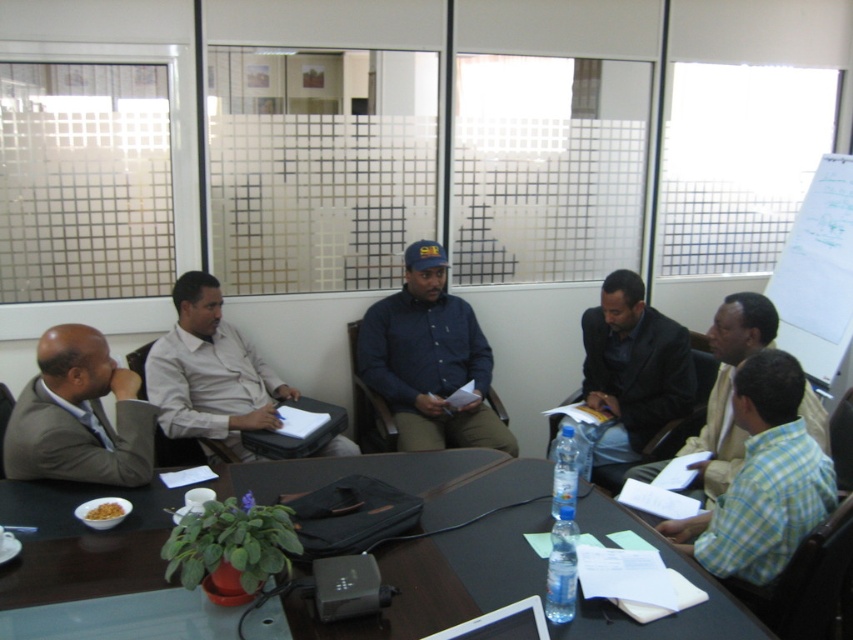
Question: Estimate the real-world distances between objects in this image. Which object is closer to the matte gray shirt at center?

Choices:
 (A) black matte suit at center
 (B) light brown shirt at center
 (C) light brown suit at left
 (D) green checkered shirt at lower right

Answer: (C)

Question: Which of the following is the farthest from the observer?

Choices:
 (A) (204, 403)
 (B) (370, 328)

Answer: (B)

Question: Which of these objects is positioned closest to the light brown shirt at center?

Choices:
 (A) dark blue shirt at center
 (B) black matte suit at center
 (C) light brown suit at left
 (D) brown wooden table at center

Answer: (B)

Question: Is light brown suit at left above black matte suit at center?

Choices:
 (A) no
 (B) yes

Answer: (A)

Question: Is dark blue shirt at center above matte gray shirt at center?

Choices:
 (A) yes
 (B) no

Answer: (A)

Question: Can you confirm if brown wooden table at center is positioned below light brown shirt at center?

Choices:
 (A) yes
 (B) no

Answer: (A)